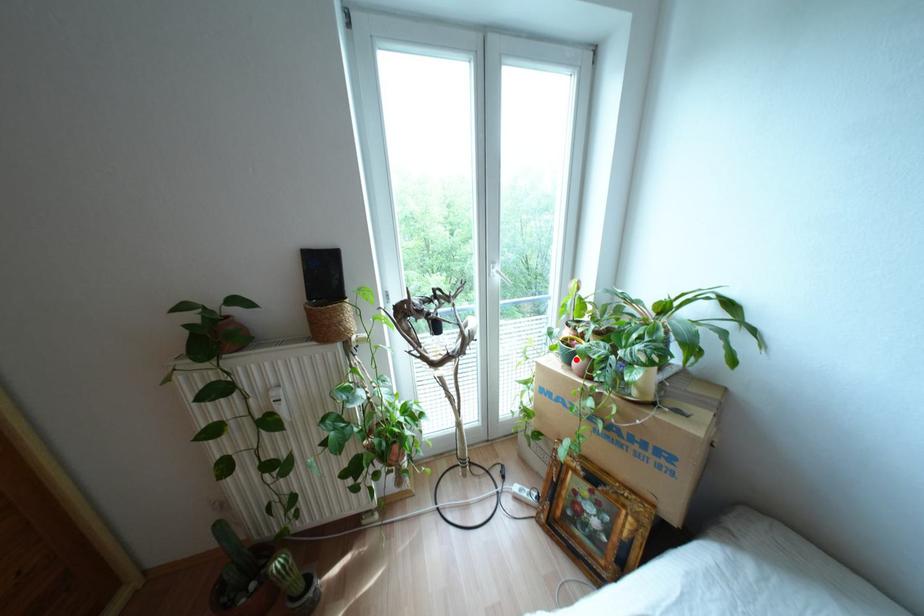
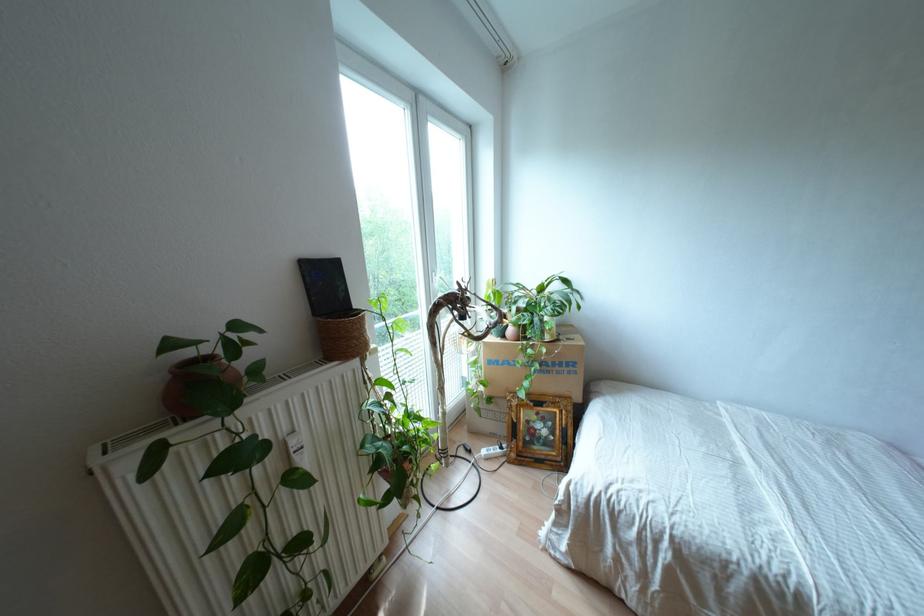
Where in the second image is the point corresponding to the highlighted location from the first image?

(509, 330)